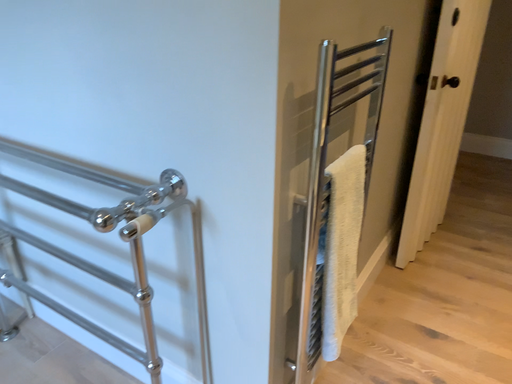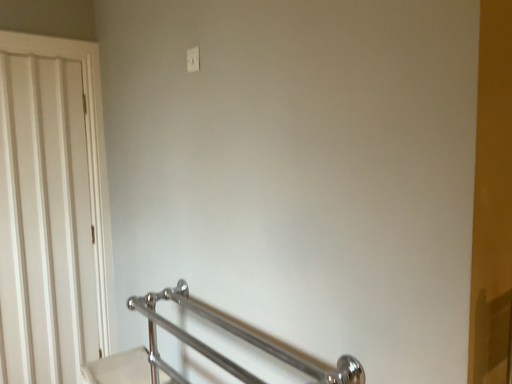
Question: Which way did the camera rotate in the video?

Choices:
 (A) rotated upward
 (B) rotated downward

Answer: (A)